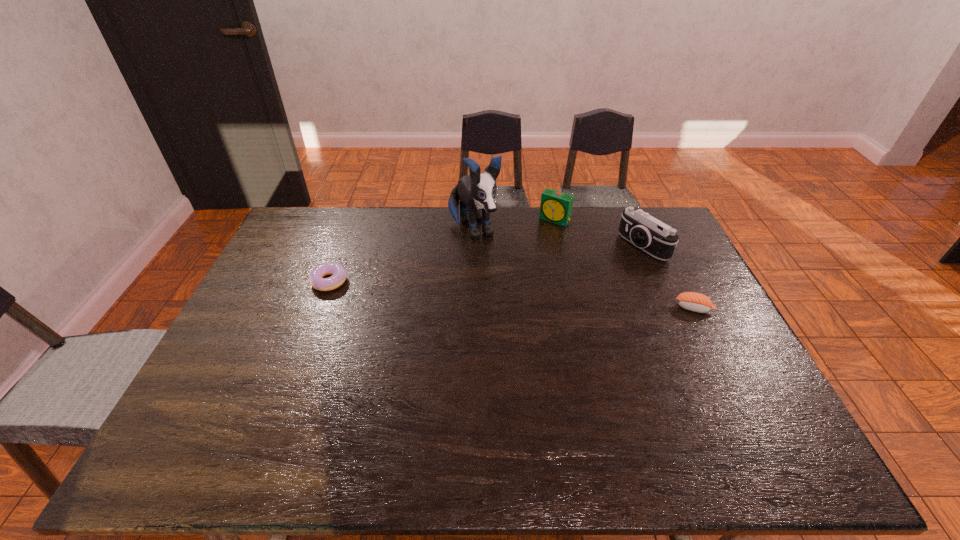
Where is `the shortest object`? Image resolution: width=960 pixels, height=540 pixels. the shortest object is located at coordinates (338, 272).

At what (x,y) coordinates should I click in order to perform the action: click on doughnut. Please return your answer as a coordinate pair (x, y). This screenshot has height=540, width=960. Looking at the image, I should click on (338, 272).

Where is `sushi`? sushi is located at coordinates (693, 301).

Where is `the fourth tallest object`? The width and height of the screenshot is (960, 540). the fourth tallest object is located at coordinates (693, 301).

At what (x,y) coordinates should I click in order to perform the action: click on puppy. Please return your answer as a coordinate pair (x, y). This screenshot has width=960, height=540. Looking at the image, I should click on (477, 191).

Where is `the fourth object from right to left`? the fourth object from right to left is located at coordinates (477, 191).

Image resolution: width=960 pixels, height=540 pixels. Identify the location of camera. (656, 238).

I want to click on alarm clock, so click(555, 206).

Find the location of a particular element. the third shortest object is located at coordinates (555, 206).

Locate an element on the screen. This screenshot has height=540, width=960. vacant space positioned 0.330m on the right of the leftmost object is located at coordinates (451, 281).